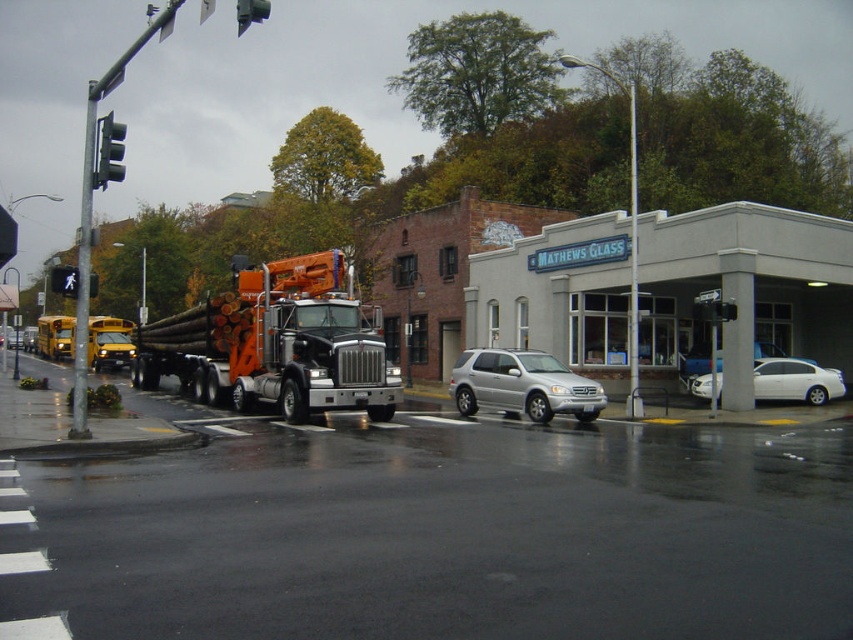
You are a delivery driver approaching the intersection and need to stop at the black glass traffic light at upper left. What is the exact coordinate where you should position your vehicle to align with the traffic light?

The black glass traffic light at upper left is located at point (109, 150), so you should position your vehicle at those coordinates to align with it.

You are a pedestrian standing at the crosswalk. You see the orange metallic truck at center represented by point (276, 342). If you want to cross the street to the Mathews Glass building, which direction should you walk relative to the truck?

The orange metallic truck at center is represented by point (276, 342). To reach the Mathews Glass building, you should walk to the right of the truck since the building is located to the truck.

You are a pedestrian waiting at the crosswalk. You see the black glass traffic light at upper left and the yellow school bus at left. Which object is closer to you?

The black glass traffic light at upper left is closer to you because it is in front of the yellow school bus at left, meaning it is positioned nearer to your viewpoint.